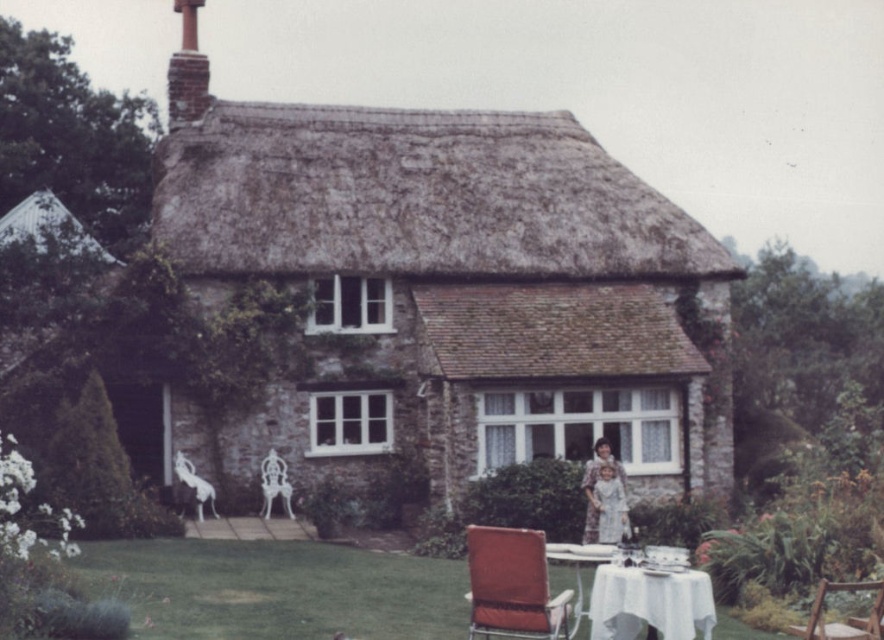
You are standing at the entrance of the cottage and want to take a photo that includes both the point at coordinates point [216,550] and point [819,628]. Which point should you focus on first to ensure both are in focus?

You should focus on point [216,550] first because it is closer to the camera than point [819,628]. This ensures that both points will be in focus when taking the photo.

You are standing in front of the stone cottage and want to determine the relative positions of two points marked in the garden. Based on the scene, which point is closer to you, point 1 at coordinates [376,584] or point 2 at coordinates [601,632]?

Point 1 at coordinates [376,584] is closer to you because it is further to the camera than point 2 at coordinates [601,632].